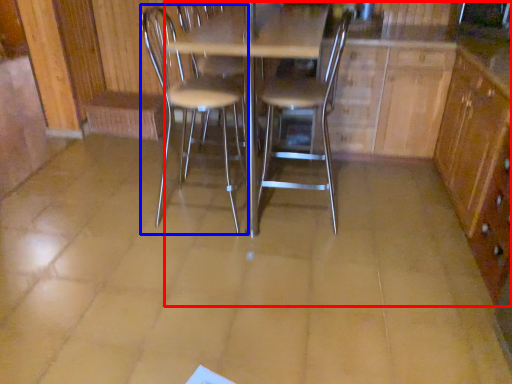
Question: Among these objects, which one is nearest to the camera, dresser (highlighted by a red box) or chair (highlighted by a blue box)?

Choices:
 (A) dresser
 (B) chair

Answer: (A)